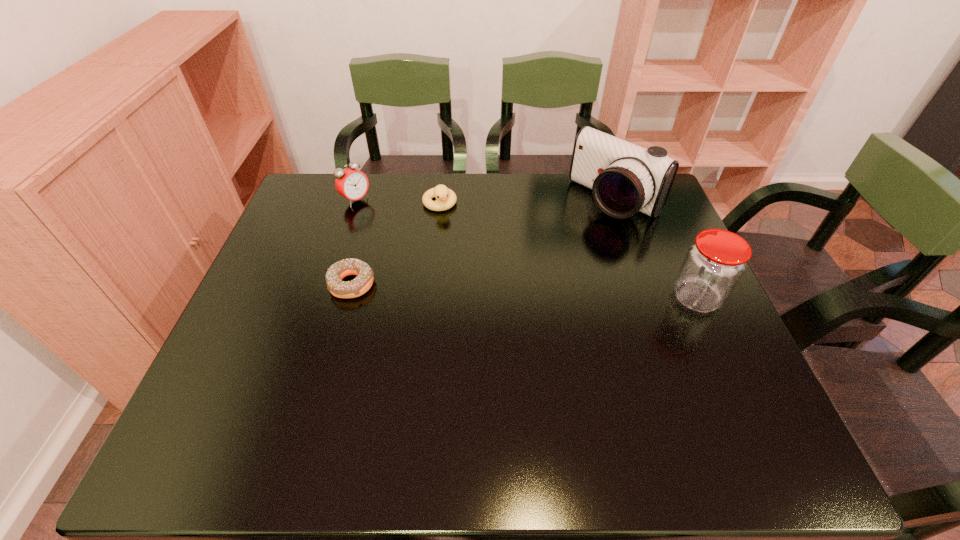
Find the location of a particular element. The width and height of the screenshot is (960, 540). object that is at the left edge is located at coordinates tap(353, 184).

The height and width of the screenshot is (540, 960). I want to click on jar located in the right edge section of the desktop, so click(x=714, y=264).

You are a GUI agent. You are given a task and a screenshot of the screen. Output one action in this format:
    pyautogui.click(x=<x>, y=<y>)
    Task: Click on the camcorder that is at the right edge
    This screenshot has height=540, width=960.
    Given the screenshot: What is the action you would take?
    pyautogui.click(x=625, y=178)

Locate an element on the screen. The image size is (960, 540). object that is at the far left corner is located at coordinates (353, 184).

This screenshot has height=540, width=960. Find the location of `object that is at the far right corner`. object that is at the far right corner is located at coordinates (625, 178).

Locate an element on the screen. This screenshot has height=540, width=960. vacant point at the far edge is located at coordinates (380, 200).

Find the location of a particular element. The width and height of the screenshot is (960, 540). vacant space at the near edge is located at coordinates (441, 403).

Where is `vacant space at the left edge of the desktop`? This screenshot has width=960, height=540. vacant space at the left edge of the desktop is located at coordinates (283, 346).

In the image, there is a desktop. Where is `vacant space at the right edge`? This screenshot has width=960, height=540. vacant space at the right edge is located at coordinates (648, 255).

Identify the location of free space at the far left corner of the desktop. (322, 190).